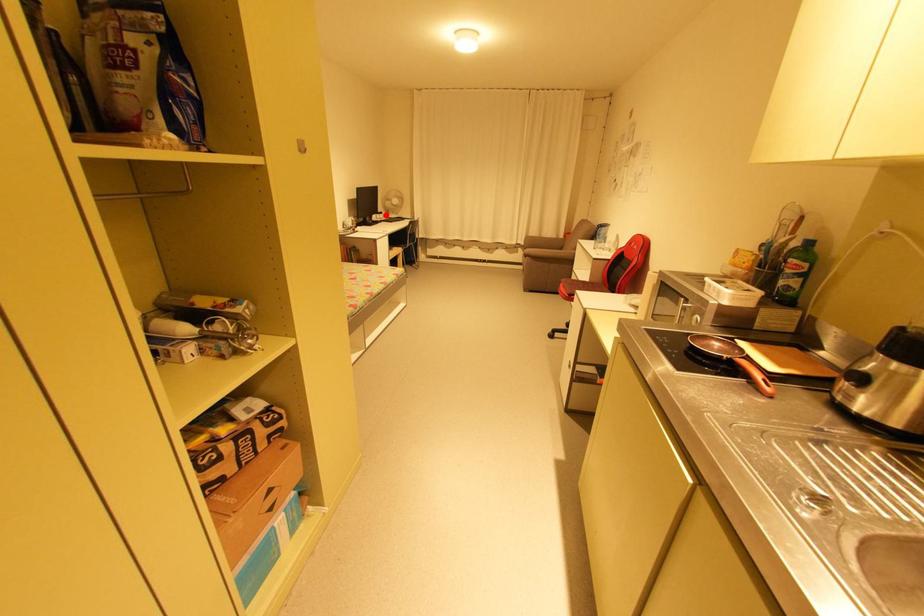
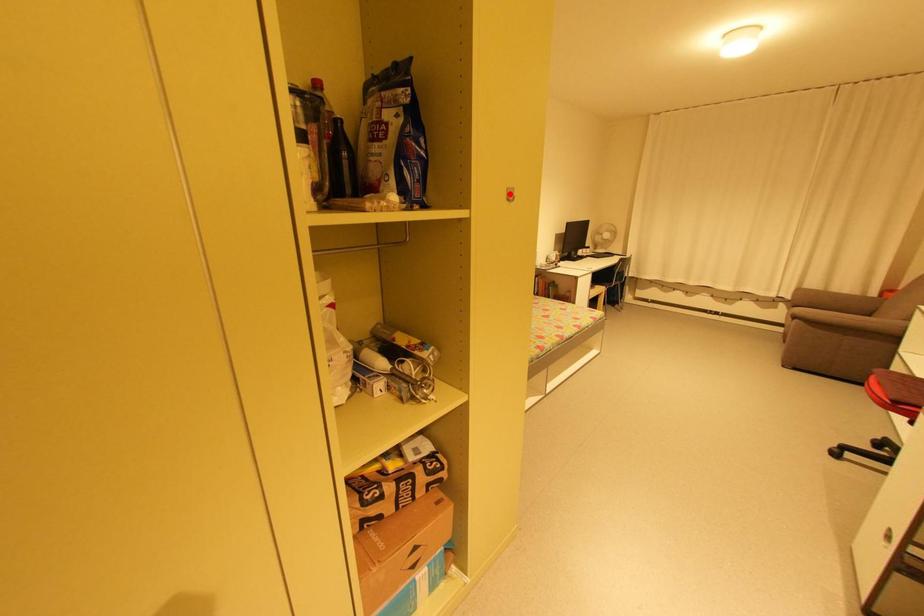
Consider the image. I am providing you with two images of the same scene from different viewpoints. A red point is marked on the first image and another point is marked on the second image. Is the marked point in image1 the same physical position as the marked point in image2?

No